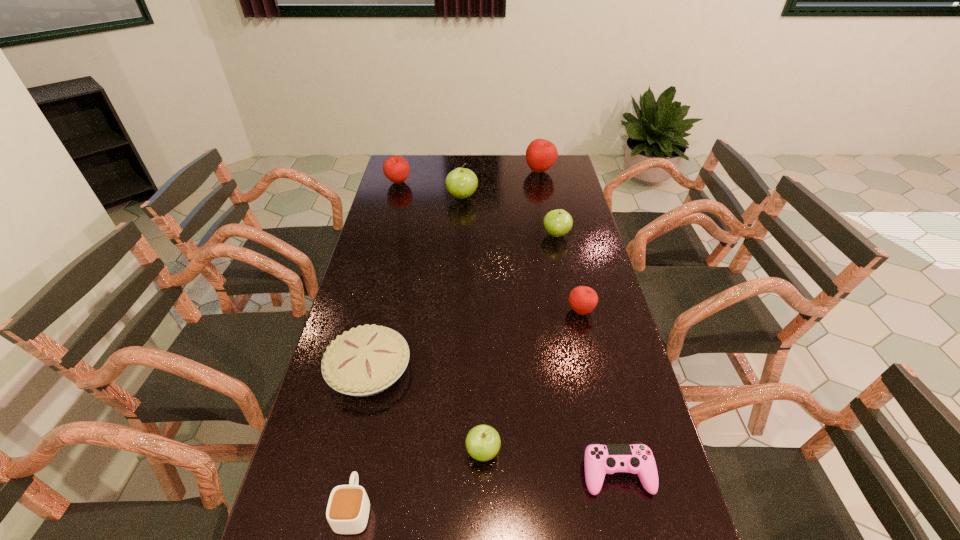
Identify which red apple is the closest to the cup. Please provide its 2D coordinates. Your answer should be formatted as a tuple, i.e. [(x, y)], where the tuple contains the x and y coordinates of a point satisfying the conditions above.

[(582, 299)]

This screenshot has height=540, width=960. What are the coordinates of `blank space that satisfies the following two spatial constraints: 1. on the back side of the biggest red apple; 2. on the left side of the pie` in the screenshot? It's located at point(414,171).

This screenshot has height=540, width=960. I want to click on vacant point that satisfies the following two spatial constraints: 1. on the front side of the biggest red apple; 2. on the right side of the fifth farthest apple, so click(568, 310).

Where is `vacant area in the image that satisfies the following two spatial constraints: 1. on the side with the handle of the cup; 2. on the right side of the biggest green apple`? The image size is (960, 540). vacant area in the image that satisfies the following two spatial constraints: 1. on the side with the handle of the cup; 2. on the right side of the biggest green apple is located at coordinates (417, 197).

Where is `vacant region that satisfies the following two spatial constraints: 1. on the side with the handle of the white cup; 2. on the right side of the second biggest green apple`? vacant region that satisfies the following two spatial constraints: 1. on the side with the handle of the white cup; 2. on the right side of the second biggest green apple is located at coordinates (409, 234).

Locate an element on the screen. The width and height of the screenshot is (960, 540). vacant region that satisfies the following two spatial constraints: 1. on the front side of the leftmost red apple; 2. on the left side of the third nearest apple is located at coordinates (384, 234).